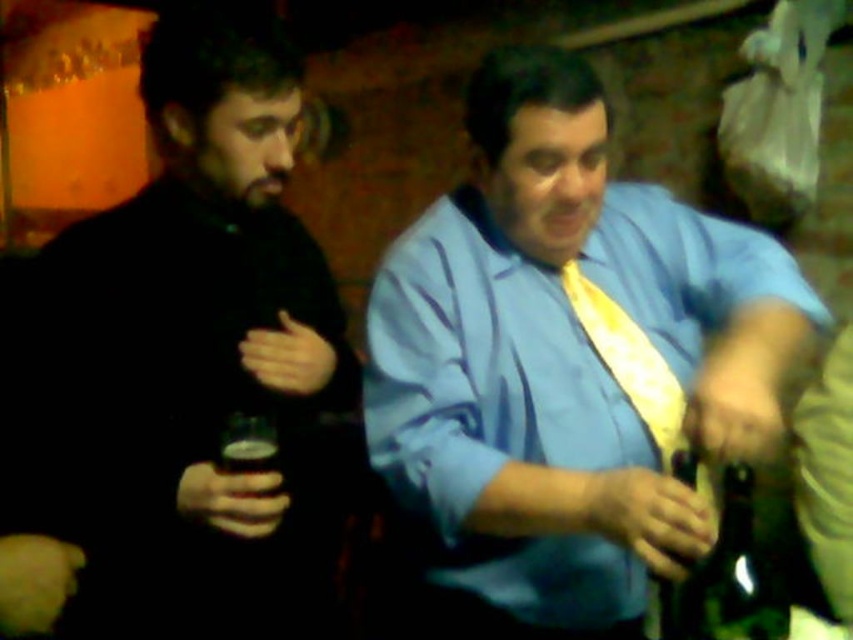
Does yellow satin tie at center have a greater height compared to green glass bottle at right?

No.

Is yellow satin tie at center below green glass bottle at right?

No.

Which is in front, point (640, 397) or point (700, 577)?

Positioned in front is point (700, 577).

The image size is (853, 640). Identify the location of yellow satin tie at center. (630, 362).

Does green glass bottle at lower right have a smaller size compared to yellow satin tie at center?

Yes.

Based on the photo, is green glass bottle at lower right closer to the viewer compared to yellow satin tie at center?

No, green glass bottle at lower right is behind yellow satin tie at center.

Measure the distance between point [711,618] and camera.

Point [711,618] and camera are 3.42 feet apart.

Locate an element on the screen. The height and width of the screenshot is (640, 853). green glass bottle at lower right is located at coordinates (738, 572).

Is blue satin shirt at center smaller than green glass bottle at right?

Actually, blue satin shirt at center might be larger than green glass bottle at right.

Is point (434, 420) positioned behind point (695, 465)?

Yes.

You are a GUI agent. You are given a task and a screenshot of the screen. Output one action in this format:
    pyautogui.click(x=<x>, y=<y>)
    Task: Click on the blue satin shirt at center
    The height and width of the screenshot is (640, 853).
    Given the screenshot: What is the action you would take?
    pyautogui.click(x=567, y=365)